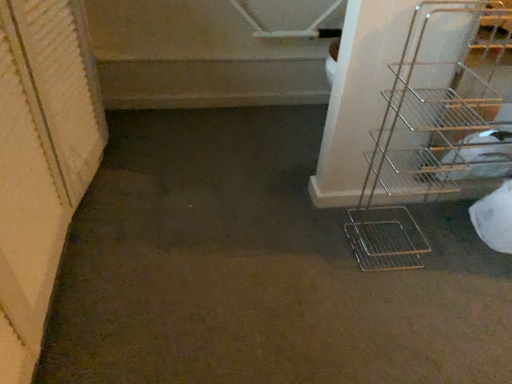
Question: In the image, is smooth concrete stairs at upper left positioned in front of or behind metallic wire rack at right?

Choices:
 (A) behind
 (B) front

Answer: (A)

Question: In terms of width, does smooth concrete stairs at upper left look wider or thinner when compared to metallic wire rack at right?

Choices:
 (A) wide
 (B) thin

Answer: (A)

Question: From the image's perspective, is smooth concrete stairs at upper left positioned above or below metallic wire rack at right?

Choices:
 (A) above
 (B) below

Answer: (A)

Question: Looking at their shapes, would you say metallic wire rack at right is wider or thinner than smooth concrete stairs at upper left?

Choices:
 (A) thin
 (B) wide

Answer: (A)

Question: Looking at the image, does metallic wire rack at right seem bigger or smaller compared to smooth concrete stairs at upper left?

Choices:
 (A) small
 (B) big

Answer: (A)

Question: Is metallic wire rack at right inside or outside of smooth concrete stairs at upper left?

Choices:
 (A) inside
 (B) outside

Answer: (B)

Question: Is point (510, 29) closer or farther from the camera than point (233, 79)?

Choices:
 (A) farther
 (B) closer

Answer: (A)